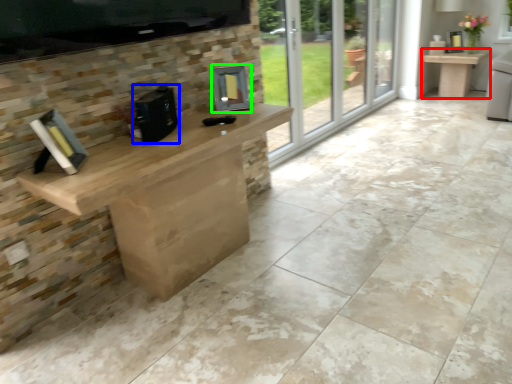
Question: Estimate the real-world distances between objects in this image. Which object is farther from table (highlighted by a red box), appliance (highlighted by a blue box) or appliance (highlighted by a green box)?

Choices:
 (A) appliance
 (B) appliance

Answer: (A)